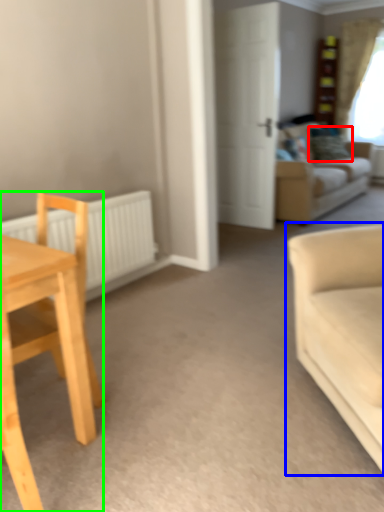
Question: Considering the real-world distances, which object is closest to pillow (highlighted by a red box)? studio couch (highlighted by a blue box) or chair (highlighted by a green box).

Choices:
 (A) studio couch
 (B) chair

Answer: (A)